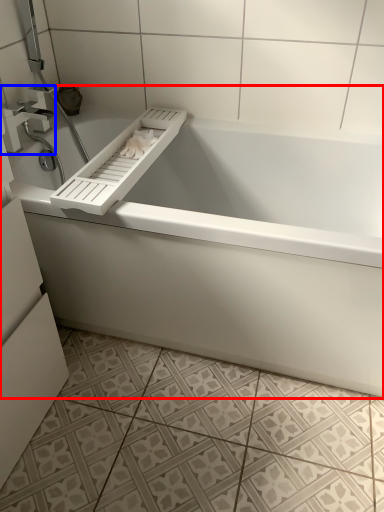
Question: Which object is further to the camera taking this photo, bathtub (highlighted by a red box) or tap (highlighted by a blue box)?

Choices:
 (A) bathtub
 (B) tap

Answer: (B)